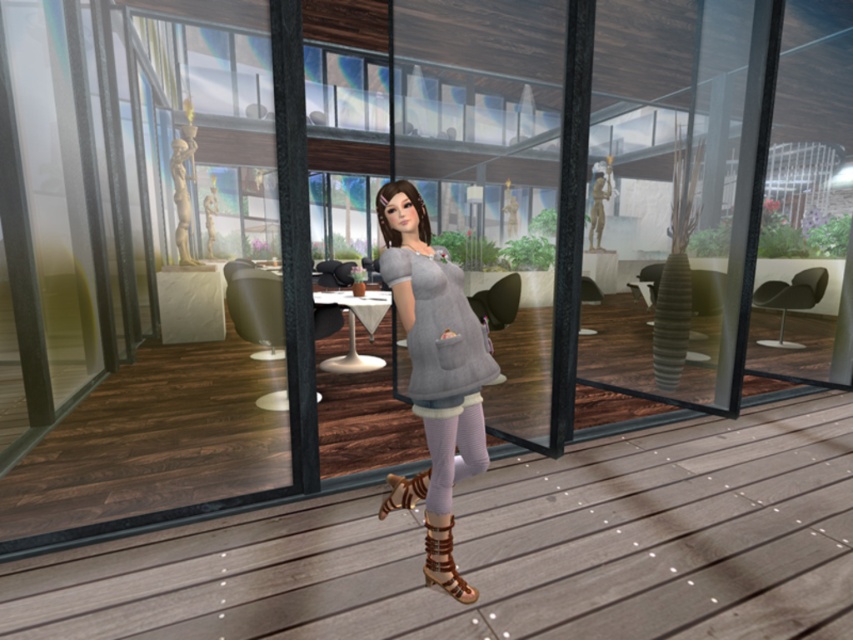
Question: Is gray fabric dress at center above brown leather boot at lower center?

Choices:
 (A) yes
 (B) no

Answer: (A)

Question: Where is brown leather boot at lower center located in relation to matte stone statue at upper left in the image?

Choices:
 (A) left
 (B) right

Answer: (B)

Question: Among these objects, which one is nearest to the camera?

Choices:
 (A) matte stone statue at upper left
 (B) brown leather boot at lower center
 (C) purple textured leggings at center
 (D) gray matte dress at center

Answer: (D)

Question: Which object is closer to the camera taking this photo?

Choices:
 (A) zebra-patterned leather boot at lower center
 (B) purple textured leggings at center
 (C) brown leather boot at lower center

Answer: (C)

Question: Which object is farther from the camera taking this photo?

Choices:
 (A) purple textured leggings at center
 (B) brown leather boot at lower center
 (C) matte stone statue at upper left
 (D) gray matte dress at center

Answer: (C)

Question: In this image, where is gray matte dress at center located relative to zebra-patterned leather boot at lower center?

Choices:
 (A) left
 (B) right

Answer: (B)